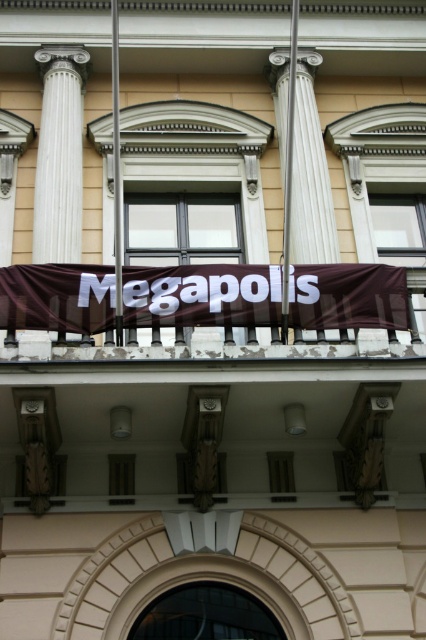
You are an architect reviewing the building facade. You notice the brown fabric banner at center and the white marble column at left. Which object takes up more visual space on the facade?

The white marble column at left occupies more visual space than the brown fabric banner at center because the banner is described as occupying less space.

You are standing in front of the classical building and want to touch both the white marble column at left and the white marble pillar at center. Which one do you need to reach out to first?

You need to reach out to the white marble column at left first because it is closer to you than the white marble pillar at center.

You are standing in front of the classical building and notice the brown fabric banner at center and the white marble pillar at center. From your perspective, which object is positioned to the left?

The brown fabric banner at center is to the left of the white marble pillar at center.